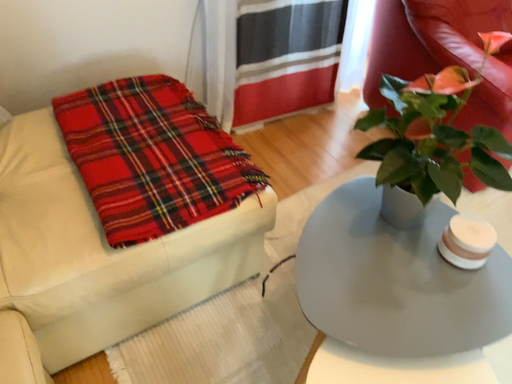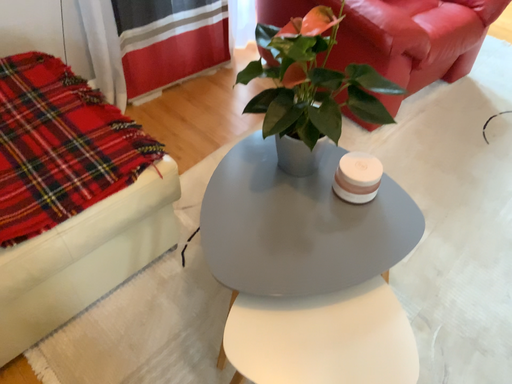
Question: How did the camera likely rotate when shooting the video?

Choices:
 (A) rotated left
 (B) rotated right

Answer: (B)